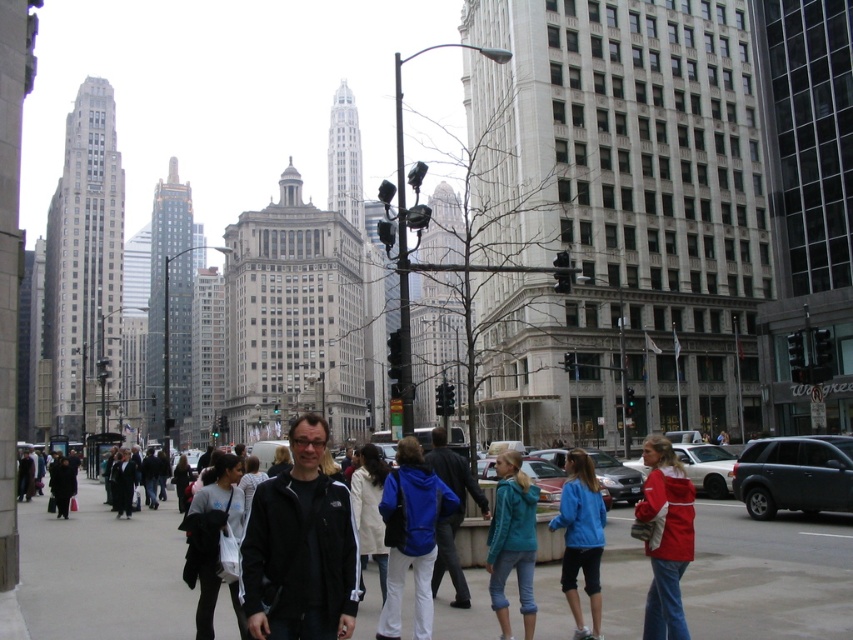
Is blue fleece jacket at center shorter than black plastic pole at center?

Correct, blue fleece jacket at center is not as tall as black plastic pole at center.

Who is taller, blue fleece jacket at center or black plastic pole at center?

With more height is black plastic pole at center.

What do you see at coordinates (410, 536) in the screenshot? The image size is (853, 640). I see `blue fleece jacket at center` at bounding box center [410, 536].

Identify the location of blue fleece jacket at center. (410, 536).

Who is shorter, black plastic pole at center or metallic gray building at center?

With less height is metallic gray building at center.

Does black plastic pole at center have a greater height compared to metallic gray building at center?

Indeed, black plastic pole at center has a greater height compared to metallic gray building at center.

Locate an element on the screen. Image resolution: width=853 pixels, height=640 pixels. black plastic pole at center is located at coordinates (402, 262).

Which is more to the left, black matte jacket at center or black plastic pole at center?

black matte jacket at center is more to the left.

Is black matte jacket at center shorter than black plastic pole at center?

Yes, black matte jacket at center is shorter than black plastic pole at center.

Does point (306, 506) come in front of point (401, 177)?

Yes, point (306, 506) is in front of point (401, 177).

Where is `black matte jacket at center`? The height and width of the screenshot is (640, 853). black matte jacket at center is located at coordinates (300, 547).